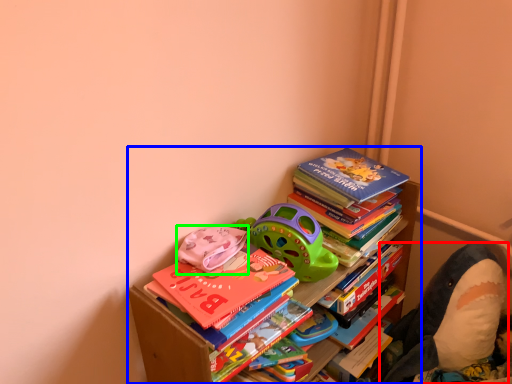
Question: Considering the real-world distances, which object is farthest from toy (highlighted by a red box)? bookcase (highlighted by a blue box) or toy (highlighted by a green box)?

Choices:
 (A) bookcase
 (B) toy

Answer: (A)